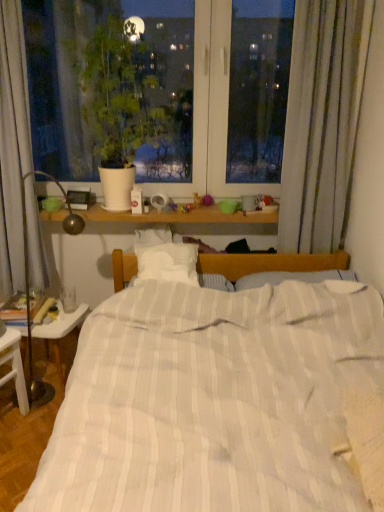
Question: In the image, is white plastic nightstand at lower left on the left side or the right side of green matte plant at upper left?

Choices:
 (A) left
 (B) right

Answer: (A)

Question: Do you think white plastic nightstand at lower left is within green matte plant at upper left, or outside of it?

Choices:
 (A) inside
 (B) outside

Answer: (B)

Question: Which of these objects is positioned closest to the white glossy table at lower left?

Choices:
 (A) white plastic nightstand at lower left
 (B) green matte plant at upper left
 (C) white striped bed at center

Answer: (A)

Question: Estimate the real-world distances between objects in this image. Which object is farther from the white plastic nightstand at lower left?

Choices:
 (A) green matte plant at upper left
 (B) white striped bed at center
 (C) white glossy table at lower left

Answer: (A)